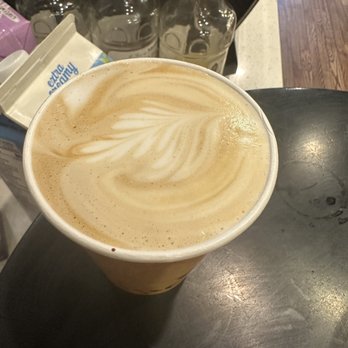
Locate an element on the screen. The height and width of the screenshot is (348, 348). cup is located at coordinates (113, 264).